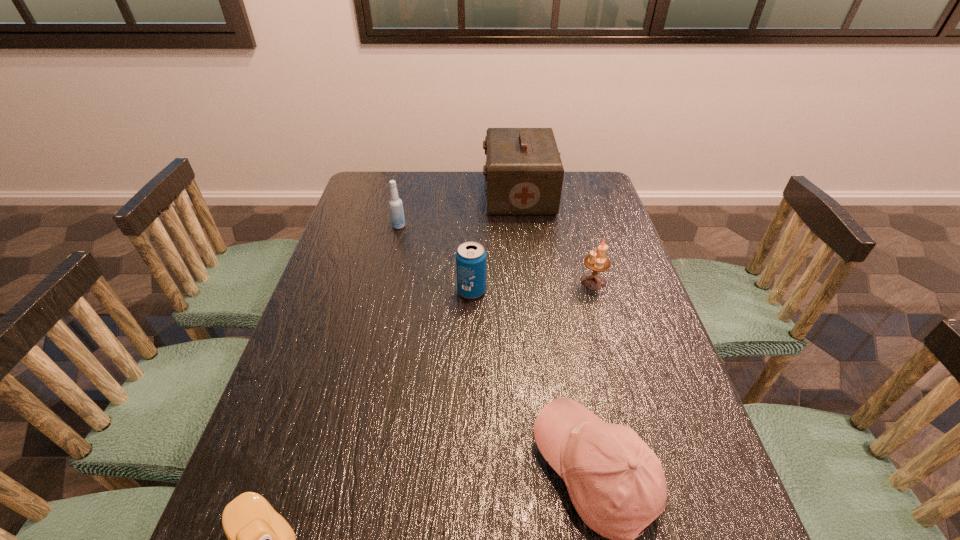
The image size is (960, 540). In order to click on the first-aid kit in this screenshot , I will do `click(524, 174)`.

Identify the location of the tallest object. (524, 174).

Locate an element on the screen. This screenshot has height=540, width=960. the second farthest object is located at coordinates (395, 204).

At what (x,y) coordinates should I click in order to perform the action: click on bottle. Please return your answer as a coordinate pair (x, y). The width and height of the screenshot is (960, 540). Looking at the image, I should click on (395, 204).

Image resolution: width=960 pixels, height=540 pixels. In order to click on soda can in this screenshot , I will do `click(470, 257)`.

Identify the location of candle holder. [597, 262].

You are a GUI agent. You are given a task and a screenshot of the screen. Output one action in this format:
    pyautogui.click(x=<x>, y=<y>)
    Task: Click on the blank space located 0.230m on the left of the first-aid kit
    
    Given the screenshot: What is the action you would take?
    pyautogui.click(x=419, y=193)

Where is `vacant space situated on the right of the bottle`? The image size is (960, 540). vacant space situated on the right of the bottle is located at coordinates (473, 226).

Where is `free space located 0.080m on the front of the soda can`? free space located 0.080m on the front of the soda can is located at coordinates (471, 323).

Locate an element on the screen. vacant region located on the front of the candle holder is located at coordinates (611, 341).